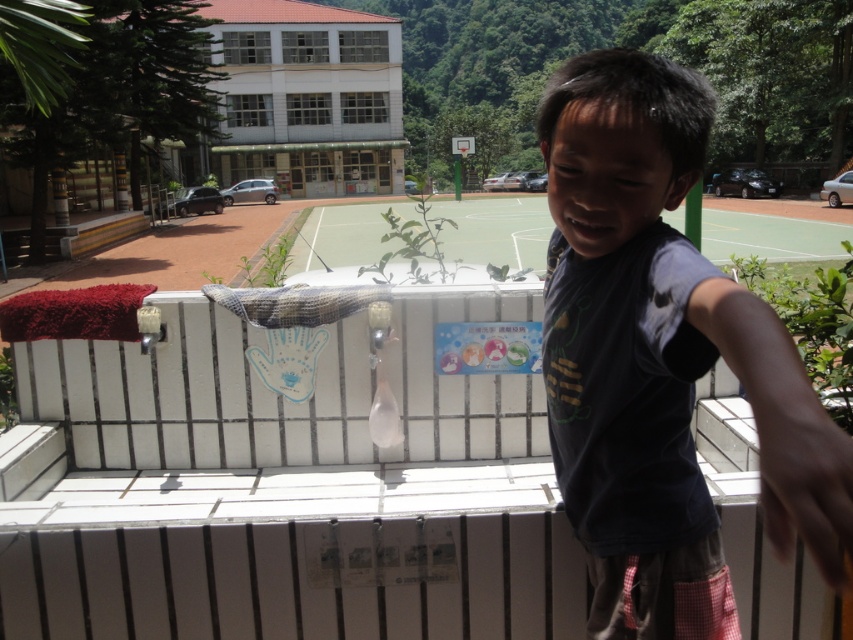
Question: Which object appears closest to the camera in this image?

Choices:
 (A) dark gray t-shirt at center
 (B) white tile balcony at center

Answer: (A)

Question: Observing the image, what is the correct spatial positioning of white tile balcony at center in reference to dark gray t-shirt at center?

Choices:
 (A) above
 (B) below

Answer: (B)

Question: Does white tile balcony at center have a smaller size compared to dark gray t-shirt at center?

Choices:
 (A) no
 (B) yes

Answer: (A)

Question: Is white tile balcony at center positioned behind dark gray t-shirt at center?

Choices:
 (A) no
 (B) yes

Answer: (B)